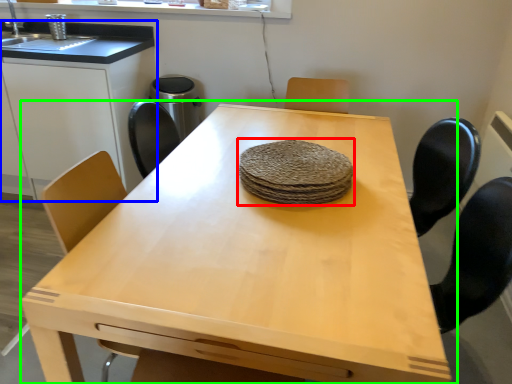
Question: Estimate the real-world distances between objects in this image. Which object is closer to food (highlighted by a red box), cabinetry (highlighted by a blue box) or table (highlighted by a green box)?

Choices:
 (A) cabinetry
 (B) table

Answer: (B)